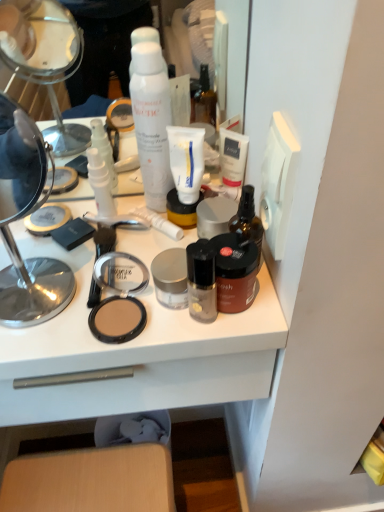
This screenshot has height=512, width=384. Identify the location of free space above matte plastic makeup at center (from a real-world perspective). (94, 259).